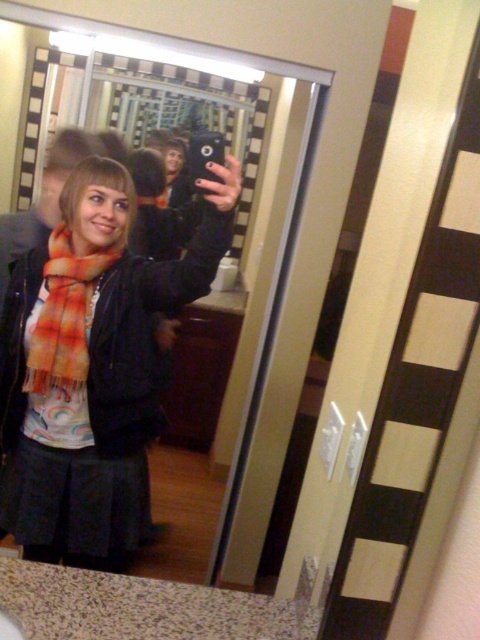
You are standing in front of the mirror and see both the orange plaid scarf at center and the orange and white striped scarf at center. Which scarf is positioned to the right side in the mirror?

The orange plaid scarf at center is positioned to the right of the orange and white striped scarf at center in the mirror.

You are standing in the room and want to place a small decorative item on the countertop near the orange plaid scarf at center. Where should you place it?

The orange plaid scarf at center is located at point (92, 365), so you should place the decorative item near that coordinate on the countertop.

You are a photographer trying to capture the orange plaid scarf at center and the orange and white striped scarf at center in a single shot. Which scarf will appear larger in the photo?

The orange plaid scarf at center will appear larger in the photo because it is closer to the viewer than the orange and white striped scarf at center.